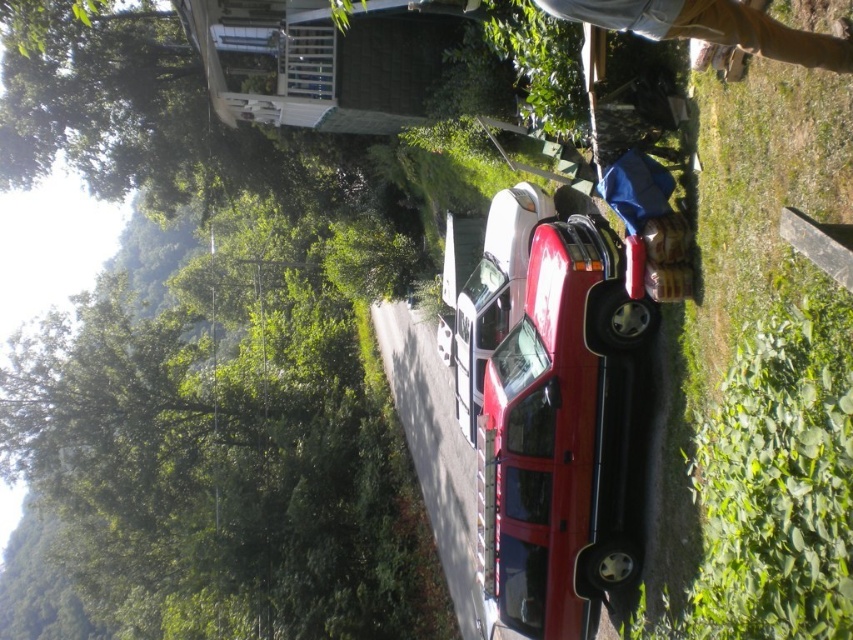
Question: Does glossy red car at center appear under tan denim pants at upper right?

Choices:
 (A) no
 (B) yes

Answer: (B)

Question: Can you confirm if glossy red car at center is bigger than tan denim pants at upper right?

Choices:
 (A) yes
 (B) no

Answer: (A)

Question: Which object appears farthest from the camera in this image?

Choices:
 (A) tan denim pants at upper right
 (B) glossy red car at center

Answer: (B)

Question: Can you confirm if glossy red car at center is bigger than tan denim pants at upper right?

Choices:
 (A) no
 (B) yes

Answer: (B)

Question: Which point is closer to the camera taking this photo?

Choices:
 (A) (740, 38)
 (B) (543, 252)

Answer: (A)